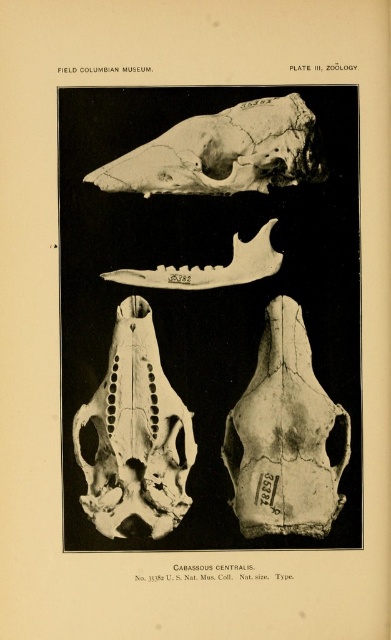
You are an anthropologist examining the skeletal remains in the image. You notice a point marked at coordinates (222, 152). Which bone does this point belong to?

The point marked at coordinates (222, 152) is on the white bone skull at upper center.